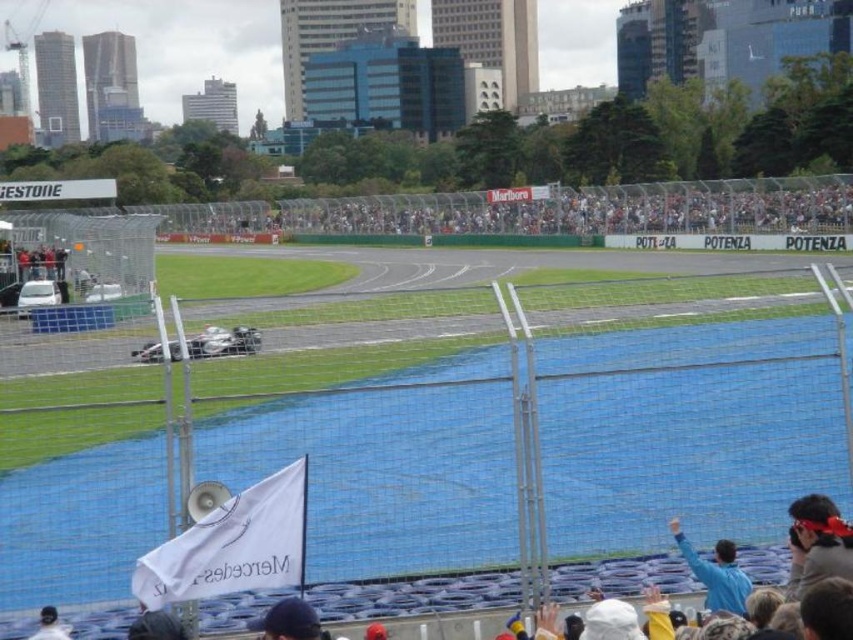
Question: Which object is positioned farthest from the white mesh crowd at center?

Choices:
 (A) dark blue fabric cap at lower center
 (B) blue fabric at lower right

Answer: (A)

Question: Estimate the real-world distances between objects in this image. Which object is closer to the dark blue fabric cap at lower center?

Choices:
 (A) blue fabric at lower right
 (B) white matte race car at center
 (C) white mesh crowd at center
 (D) smooth black helmet at lower left

Answer: (D)

Question: Is blue fabric at lower right positioned in front of white matte race car at center?

Choices:
 (A) yes
 (B) no

Answer: (A)

Question: Observing the image, what is the correct spatial positioning of gray fabric cap at lower right in reference to blue fabric at lower right?

Choices:
 (A) left
 (B) right

Answer: (B)

Question: Which point is closer to the camera?

Choices:
 (A) dark blue fabric cap at lower center
 (B) white mesh crowd at center

Answer: (A)

Question: Is gray fabric cap at lower right wider than blue fabric at lower right?

Choices:
 (A) yes
 (B) no

Answer: (B)